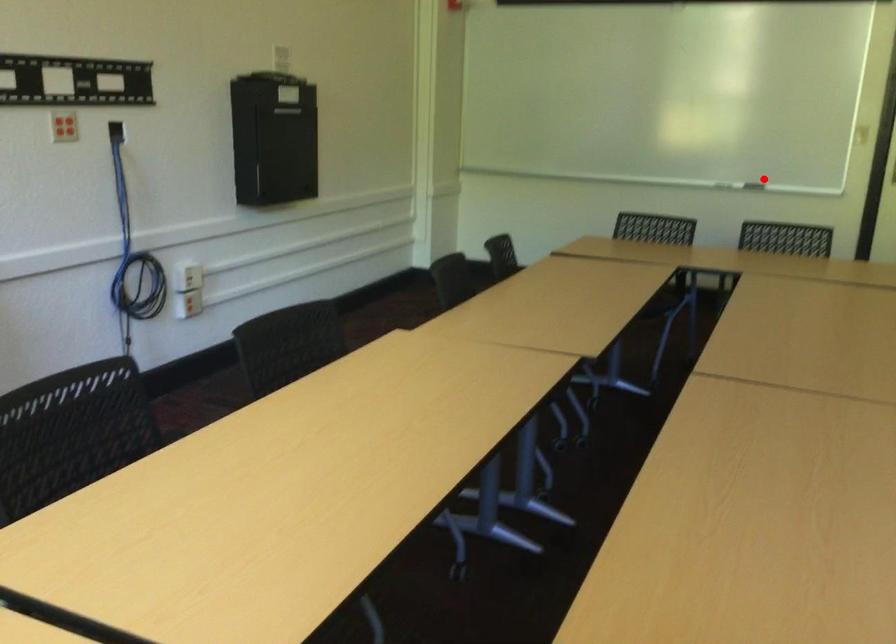
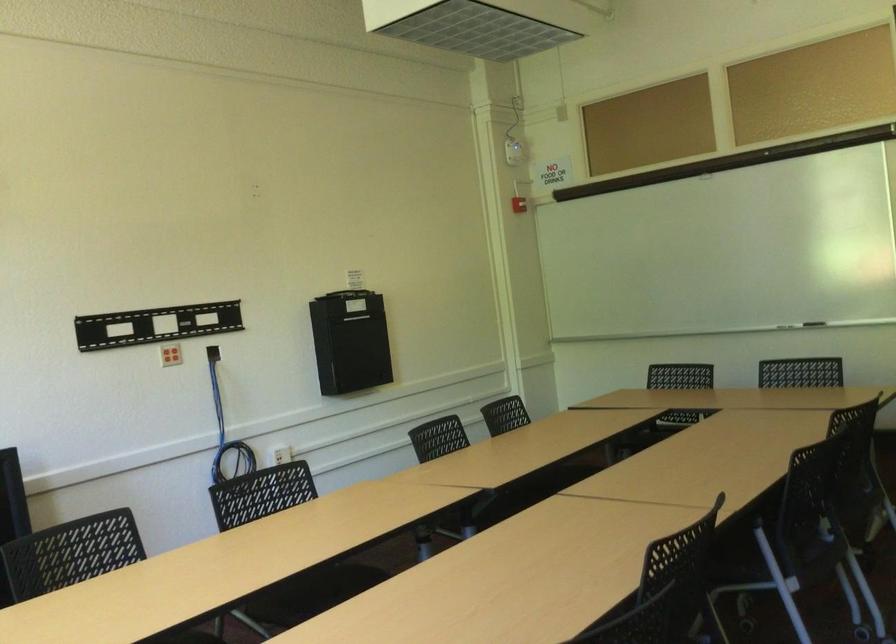
Find the pixel in the second image that matches the highlighted location in the first image.

(814, 323)